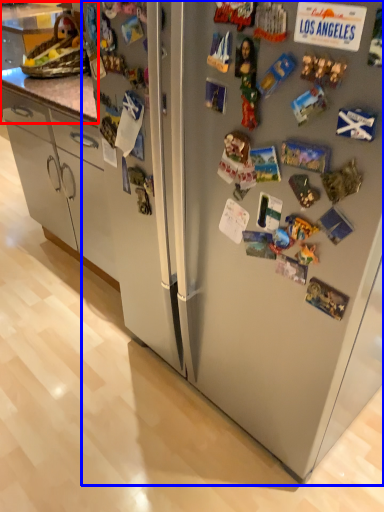
Question: Which point is further to the camera, counter top (highlighted by a red box) or refrigerator (highlighted by a blue box)?

Choices:
 (A) counter top
 (B) refrigerator

Answer: (A)